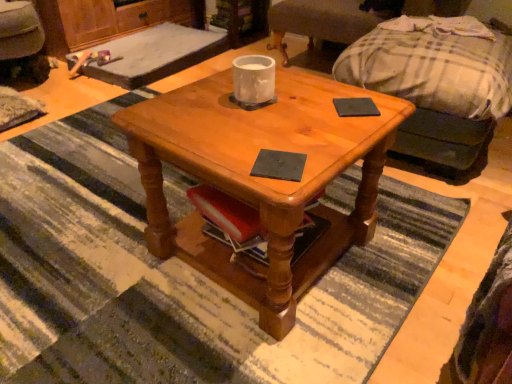
The width and height of the screenshot is (512, 384). I want to click on free spot to the left of black matte pad at center, the 1th pad when ordered from right to left, so click(298, 110).